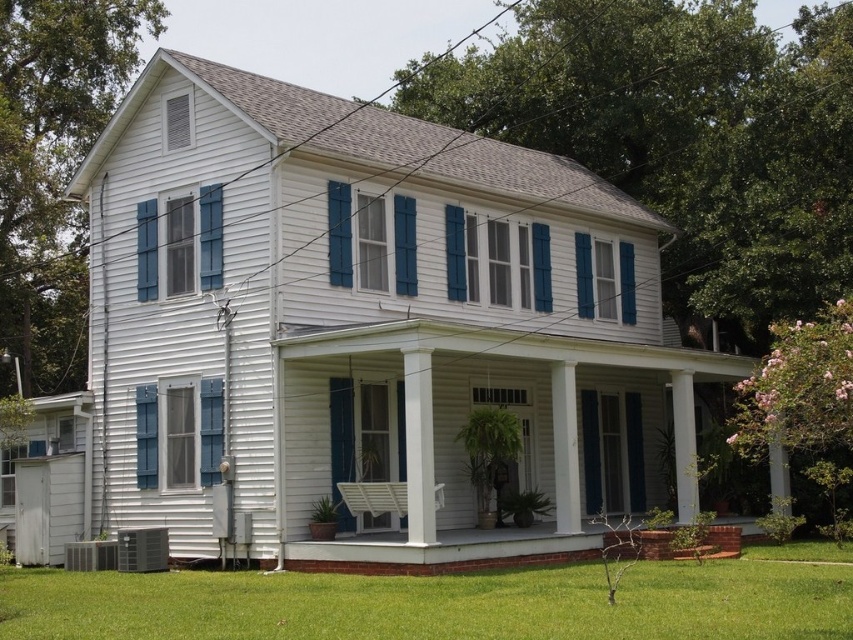
Question: Which of the following is the closest to the observer?

Choices:
 (A) white wood porch at center
 (B) green grass at lower center
 (C) white wood porch at lower center

Answer: (B)

Question: Can you confirm if white wood porch at center is positioned to the right of green grass at lower center?

Choices:
 (A) no
 (B) yes

Answer: (B)

Question: Which is farther from the green grass at lower center?

Choices:
 (A) white wood porch at center
 (B) white wood porch at lower center

Answer: (A)

Question: Which object is the farthest from the white wood porch at lower center?

Choices:
 (A) green grass at lower center
 (B) white wood porch at center

Answer: (A)

Question: Can you confirm if white wood porch at center is positioned to the right of white wood porch at lower center?

Choices:
 (A) no
 (B) yes

Answer: (B)

Question: Is green grass at lower center closer to camera compared to white wood porch at lower center?

Choices:
 (A) yes
 (B) no

Answer: (A)